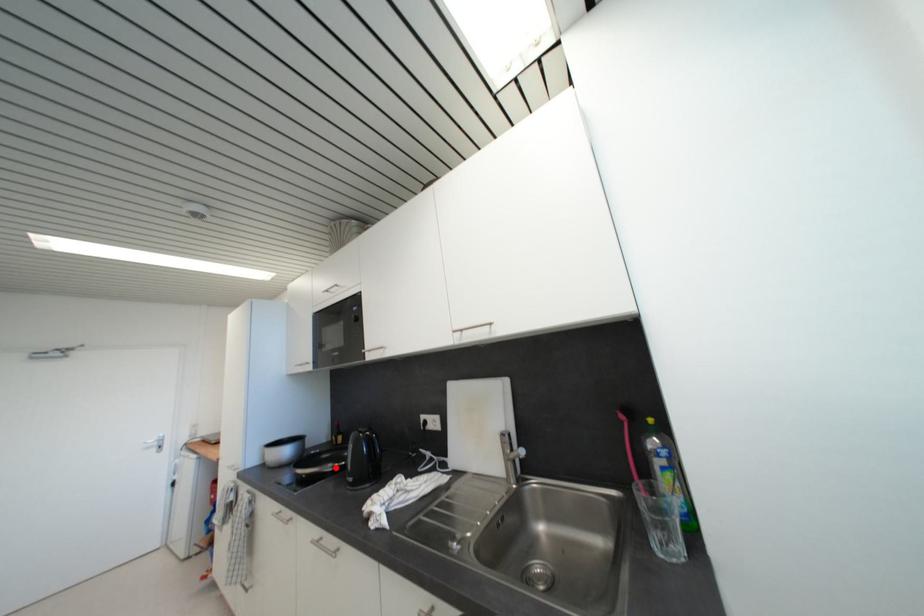
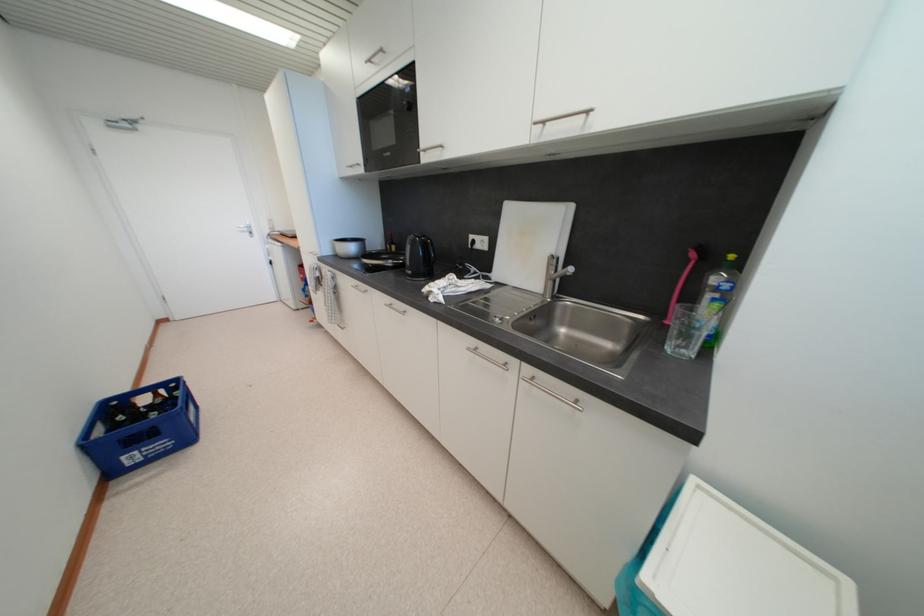
Question: I am providing you with two images of the same scene from different viewpoints. A red point is shown in image1. For the corresponding object point in image2, is it positioned nearer or farther from the camera?

Choices:
 (A) Nearer
 (B) Farther

Answer: (A)